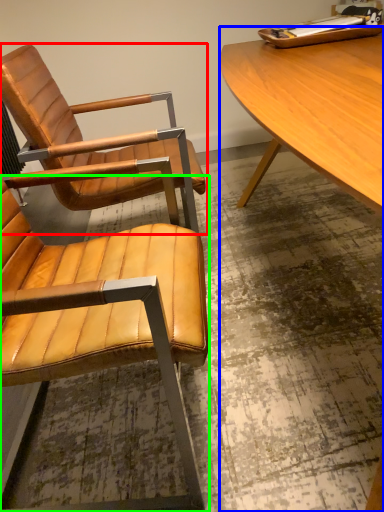
Question: Which object is the closest to the chair (highlighted by a red box)? Choose among these: desk (highlighted by a blue box) or chair (highlighted by a green box).

Choices:
 (A) desk
 (B) chair

Answer: (B)